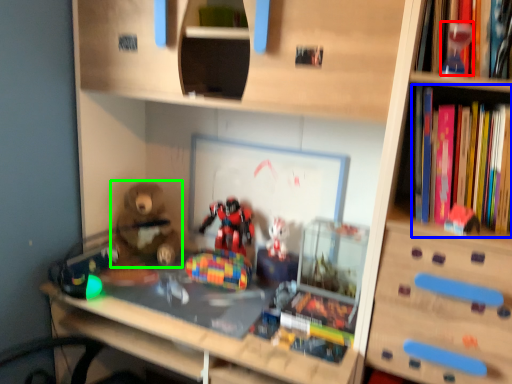
Question: Which is farther away from toy (highlighted by a red box)? book (highlighted by a blue box) or toy (highlighted by a green box)?

Choices:
 (A) book
 (B) toy

Answer: (B)